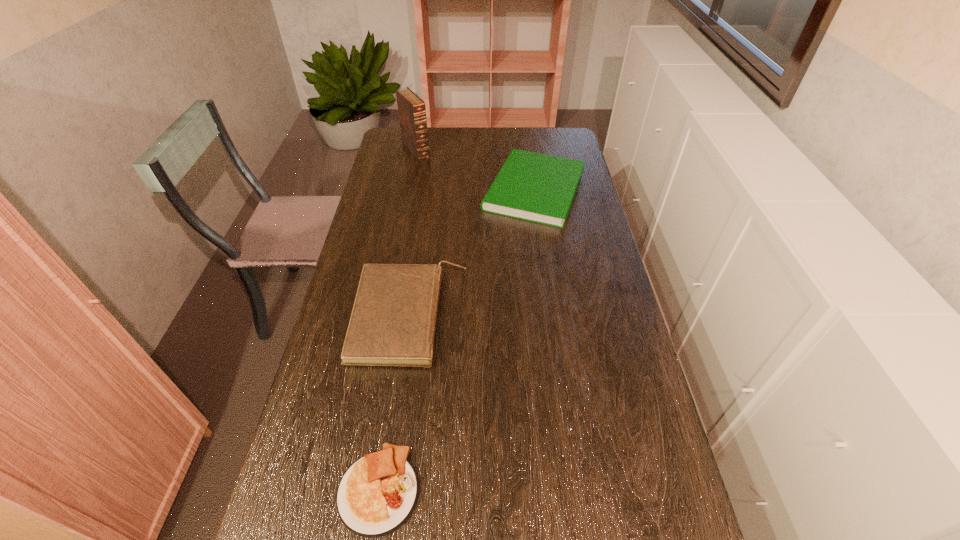
Where is `blank space that satisfies the following two spatial constraints: 1. on the back side of the nearest object; 2. on the left side of the farther paperback book`? This screenshot has height=540, width=960. blank space that satisfies the following two spatial constraints: 1. on the back side of the nearest object; 2. on the left side of the farther paperback book is located at coordinates (424, 190).

You are a GUI agent. You are given a task and a screenshot of the screen. Output one action in this format:
    pyautogui.click(x=<x>, y=<y>)
    Task: Click on the free location that satisfies the following two spatial constraints: 1. on the front side of the omelet; 2. on the left side of the tallest object
    The image size is (960, 540).
    Given the screenshot: What is the action you would take?
    pyautogui.click(x=349, y=489)

The height and width of the screenshot is (540, 960). What are the coordinates of `free location that satisfies the following two spatial constraints: 1. on the back side of the shorter paperback book; 2. on the left side of the nearest object` in the screenshot? It's located at (424, 190).

At what (x,y) coordinates should I click in order to perform the action: click on vacant space that satisfies the following two spatial constraints: 1. on the front side of the shortest object; 2. on the left side of the Bible. Please return your answer as a coordinate pair (x, y). Looking at the image, I should click on (349, 489).